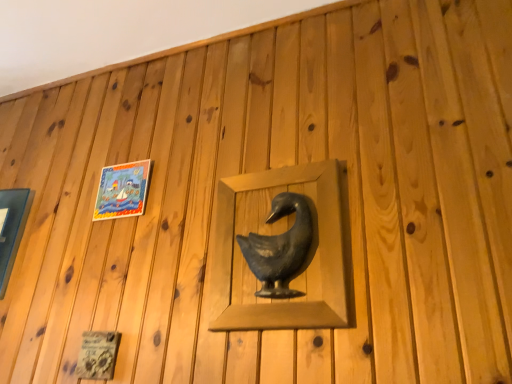
Image resolution: width=512 pixels, height=384 pixels. What do you see at coordinates (12, 229) in the screenshot? I see `matte glass picture frame at left, which is counted as the 2th picture frame, starting from the right` at bounding box center [12, 229].

Locate an element on the screen. matte black duck at center is located at coordinates (277, 233).

Considering the positions of objects matte black duck at center and matte plastic picture frame at upper left, placed as the 1th picture frame when sorted from right to left, in the image provided, who is behind, matte black duck at center or matte plastic picture frame at upper left, placed as the 1th picture frame when sorted from right to left,?

Positioned behind is matte plastic picture frame at upper left, placed as the 1th picture frame when sorted from right to left.

Does point (318, 211) come closer to viewer compared to point (132, 171)?

Yes, it is in front of point (132, 171).

Is matte plastic picture frame at upper left, the 2th picture frame when ordered from left to right, located within matte black duck at center?

No, matte plastic picture frame at upper left, the 2th picture frame when ordered from left to right, is not inside matte black duck at center.

Can you tell me how much matte plastic picture frame at upper left, the 2th picture frame when ordered from left to right, and matte glass picture frame at left, which is counted as the 2th picture frame, starting from the right, differ in facing direction?

They differ by 0.249 degrees in their facing directions.

Is matte plastic picture frame at upper left, placed as the 1th picture frame when sorted from right to left, behind matte glass picture frame at left, marked as the first picture frame in a left-to-right arrangement?

No, the depth of matte plastic picture frame at upper left, placed as the 1th picture frame when sorted from right to left, is less than that of matte glass picture frame at left, marked as the first picture frame in a left-to-right arrangement.

How much distance is there between matte plastic picture frame at upper left, placed as the 1th picture frame when sorted from right to left, and matte glass picture frame at left, marked as the first picture frame in a left-to-right arrangement?

29.89 centimeters.

Is matte plastic picture frame at upper left, the 2th picture frame when ordered from left to right, to the left of matte glass picture frame at left, marked as the first picture frame in a left-to-right arrangement, from the viewer's perspective?

No, matte plastic picture frame at upper left, the 2th picture frame when ordered from left to right, is not to the left of matte glass picture frame at left, marked as the first picture frame in a left-to-right arrangement.

Can you confirm if matte black duck at center is taller than matte glass picture frame at left, marked as the first picture frame in a left-to-right arrangement?

Yes, matte black duck at center is taller than matte glass picture frame at left, marked as the first picture frame in a left-to-right arrangement.

Identify the location of sculpture above the matte glass picture frame at left, marked as the first picture frame in a left-to-right arrangement (from the image's perspective). Image resolution: width=512 pixels, height=384 pixels. (277, 233).

Is matte black duck at center thinner than matte glass picture frame at left, which is counted as the 2th picture frame, starting from the right?

Correct, the width of matte black duck at center is less than that of matte glass picture frame at left, which is counted as the 2th picture frame, starting from the right.

Is matte black duck at center far away from matte glass picture frame at left, marked as the first picture frame in a left-to-right arrangement?

matte black duck at center is near matte glass picture frame at left, marked as the first picture frame in a left-to-right arrangement, not far away.

From a real-world perspective, is matte glass picture frame at left, which is counted as the 2th picture frame, starting from the right, physically below matte black duck at center?

Actually, matte glass picture frame at left, which is counted as the 2th picture frame, starting from the right, is physically above matte black duck at center in the real world.

Is matte glass picture frame at left, which is counted as the 2th picture frame, starting from the right, spatially inside matte black duck at center, or outside of it?

matte glass picture frame at left, which is counted as the 2th picture frame, starting from the right, is spatially situated outside matte black duck at center.

Is matte glass picture frame at left, which is counted as the 2th picture frame, starting from the right, directly adjacent to matte black duck at center?

There is a gap between matte glass picture frame at left, which is counted as the 2th picture frame, starting from the right, and matte black duck at center.

Considering the relative sizes of matte glass picture frame at left, which is counted as the 2th picture frame, starting from the right, and matte black duck at center in the image provided, is matte glass picture frame at left, which is counted as the 2th picture frame, starting from the right, smaller than matte black duck at center?

Actually, matte glass picture frame at left, which is counted as the 2th picture frame, starting from the right, might be larger than matte black duck at center.

This screenshot has width=512, height=384. I want to click on picture frame behind the matte plastic picture frame at upper left, the 2th picture frame when ordered from left to right, so click(x=12, y=229).

Between point (2, 235) and point (147, 175), which one is positioned in front?

The point (147, 175) is more forward.

Considering the sizes of objects matte glass picture frame at left, which is counted as the 2th picture frame, starting from the right, and matte plastic picture frame at upper left, placed as the 1th picture frame when sorted from right to left, in the image provided, who is thinner, matte glass picture frame at left, which is counted as the 2th picture frame, starting from the right, or matte plastic picture frame at upper left, placed as the 1th picture frame when sorted from right to left,?

matte plastic picture frame at upper left, placed as the 1th picture frame when sorted from right to left, is thinner.

From a real-world perspective, is matte glass picture frame at left, which is counted as the 2th picture frame, starting from the right, physically located above or below matte plastic picture frame at upper left, placed as the 1th picture frame when sorted from right to left?

matte glass picture frame at left, which is counted as the 2th picture frame, starting from the right, is situated lower than matte plastic picture frame at upper left, placed as the 1th picture frame when sorted from right to left, in the real world.

From a real-world perspective, is matte plastic picture frame at upper left, placed as the 1th picture frame when sorted from right to left, physically located above or below matte black duck at center?

matte plastic picture frame at upper left, placed as the 1th picture frame when sorted from right to left, is above matte black duck at center.

This screenshot has width=512, height=384. In order to click on sculpture that is on the right side of matte plastic picture frame at upper left, placed as the 1th picture frame when sorted from right to left in this screenshot , I will do `click(277, 233)`.

Is matte plastic picture frame at upper left, placed as the 1th picture frame when sorted from right to left, facing away from matte black duck at center?

No.

Considering the relative sizes of matte plastic picture frame at upper left, the 2th picture frame when ordered from left to right, and matte black duck at center in the image provided, is matte plastic picture frame at upper left, the 2th picture frame when ordered from left to right, shorter than matte black duck at center?

Indeed, matte plastic picture frame at upper left, the 2th picture frame when ordered from left to right, has a lesser height compared to matte black duck at center.

Identify the location of the 2nd picture frame positioned above the matte black duck at center (from a real-world perspective). (122, 190).

Find the location of a particular element. picture frame behind the matte plastic picture frame at upper left, the 2th picture frame when ordered from left to right is located at coordinates (12, 229).

From the image, which object appears to be nearer to matte plastic picture frame at upper left, placed as the 1th picture frame when sorted from right to left, matte glass picture frame at left, marked as the first picture frame in a left-to-right arrangement, or matte black duck at center?

matte glass picture frame at left, marked as the first picture frame in a left-to-right arrangement, is positioned closer to the anchor matte plastic picture frame at upper left, placed as the 1th picture frame when sorted from right to left.

From the image, which object appears to be farther from matte black duck at center, matte plastic picture frame at upper left, placed as the 1th picture frame when sorted from right to left, or matte glass picture frame at left, marked as the first picture frame in a left-to-right arrangement?

Based on the image, matte glass picture frame at left, marked as the first picture frame in a left-to-right arrangement, appears to be further to matte black duck at center.

Considering their positions, is matte plastic picture frame at upper left, placed as the 1th picture frame when sorted from right to left, positioned closer to matte glass picture frame at left, marked as the first picture frame in a left-to-right arrangement, than matte black duck at center?

matte plastic picture frame at upper left, placed as the 1th picture frame when sorted from right to left, lies closer to matte glass picture frame at left, marked as the first picture frame in a left-to-right arrangement, than the other object.

Which object lies nearer to the anchor point matte black duck at center, matte glass picture frame at left, which is counted as the 2th picture frame, starting from the right, or matte plastic picture frame at upper left, the 2th picture frame when ordered from left to right?

matte plastic picture frame at upper left, the 2th picture frame when ordered from left to right.

Estimate the real-world distances between objects in this image. Which object is further from matte glass picture frame at left, which is counted as the 2th picture frame, starting from the right, matte black duck at center or matte plastic picture frame at upper left, the 2th picture frame when ordered from left to right?

matte black duck at center is further to matte glass picture frame at left, which is counted as the 2th picture frame, starting from the right.

From the image, which object appears to be farther from matte plastic picture frame at upper left, the 2th picture frame when ordered from left to right, matte black duck at center or matte glass picture frame at left, marked as the first picture frame in a left-to-right arrangement?

matte black duck at center is positioned further to the anchor matte plastic picture frame at upper left, the 2th picture frame when ordered from left to right.

Identify the location of picture frame situated between matte glass picture frame at left, which is counted as the 2th picture frame, starting from the right, and matte black duck at center from left to right. (122, 190).